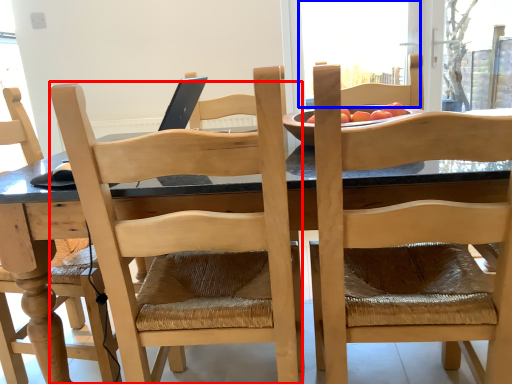
Question: Which point is further to the camera, chair (highlighted by a red box) or window screen (highlighted by a blue box)?

Choices:
 (A) chair
 (B) window screen

Answer: (B)